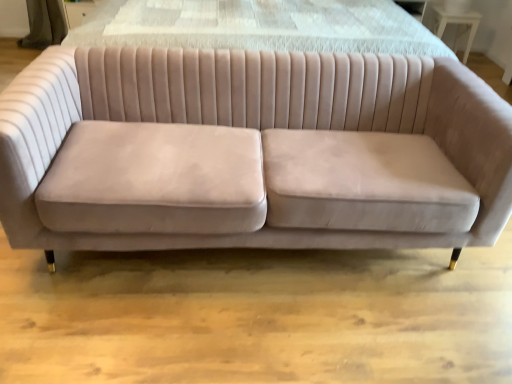
Question: Is velvet beige couch at center far from white glossy table at upper right?

Choices:
 (A) no
 (B) yes

Answer: (B)

Question: Is velvet beige couch at center in front of white glossy table at upper right?

Choices:
 (A) yes
 (B) no

Answer: (A)

Question: Does velvet beige couch at center appear on the right side of white glossy table at upper right?

Choices:
 (A) no
 (B) yes

Answer: (A)

Question: Is velvet beige couch at center completely or partially outside of white glossy table at upper right?

Choices:
 (A) no
 (B) yes

Answer: (B)

Question: Is velvet beige couch at center wider than white glossy table at upper right?

Choices:
 (A) no
 (B) yes

Answer: (B)

Question: Does velvet beige couch at center appear on the left side of white glossy table at upper right?

Choices:
 (A) no
 (B) yes

Answer: (B)

Question: Is white glossy table at upper right positioned before velvet beige couch at center?

Choices:
 (A) yes
 (B) no

Answer: (B)

Question: From a real-world perspective, does white glossy table at upper right sit lower than velvet beige couch at center?

Choices:
 (A) no
 (B) yes

Answer: (B)

Question: Is white glossy table at upper right wider than velvet beige couch at center?

Choices:
 (A) no
 (B) yes

Answer: (A)

Question: Is white glossy table at upper right at the right side of velvet beige couch at center?

Choices:
 (A) yes
 (B) no

Answer: (A)

Question: Is white glossy table at upper right not within velvet beige couch at center?

Choices:
 (A) no
 (B) yes

Answer: (B)

Question: Is white glossy table at upper right shorter than velvet beige couch at center?

Choices:
 (A) yes
 (B) no

Answer: (A)

Question: Which is correct: velvet beige couch at center is inside white glossy table at upper right, or outside of it?

Choices:
 (A) outside
 (B) inside

Answer: (A)